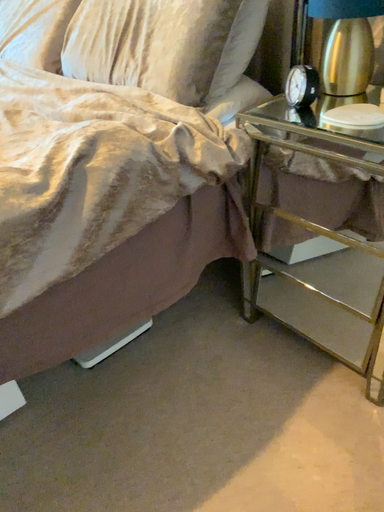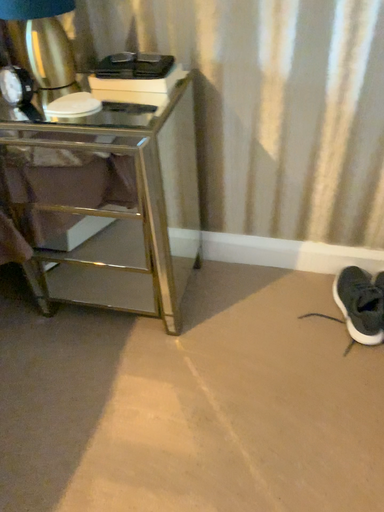
Question: How did the camera likely rotate when shooting the video?

Choices:
 (A) rotated left
 (B) rotated right

Answer: (B)